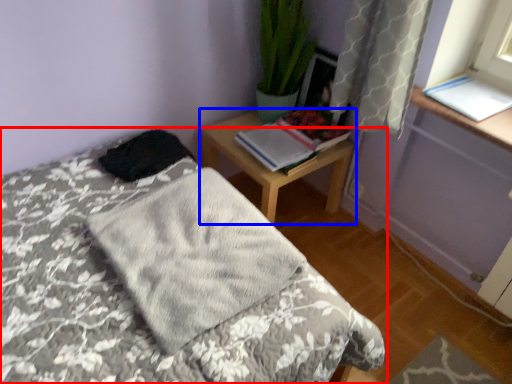
Question: Which point is closer to the camera, bed (highlighted by a red box) or nightstand (highlighted by a blue box)?

Choices:
 (A) bed
 (B) nightstand

Answer: (A)